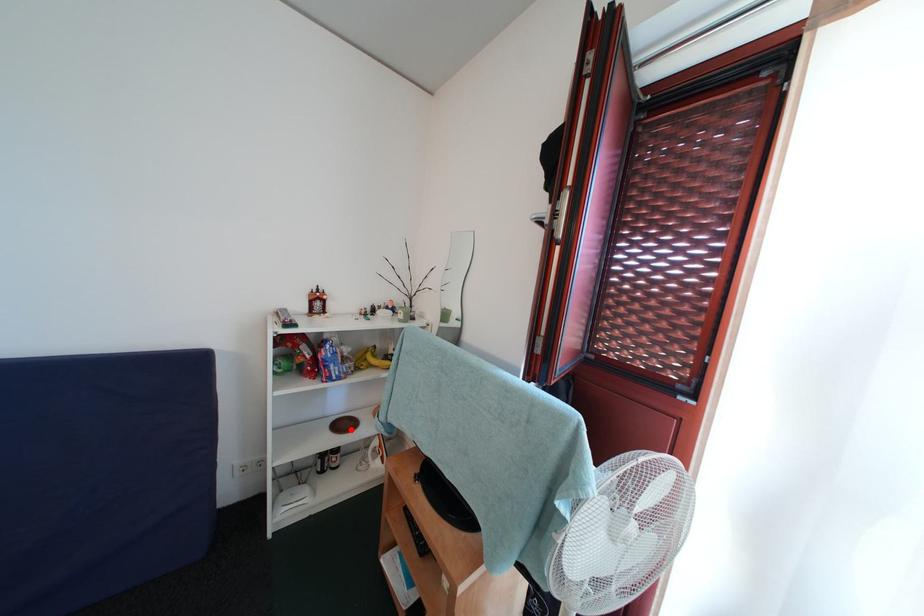
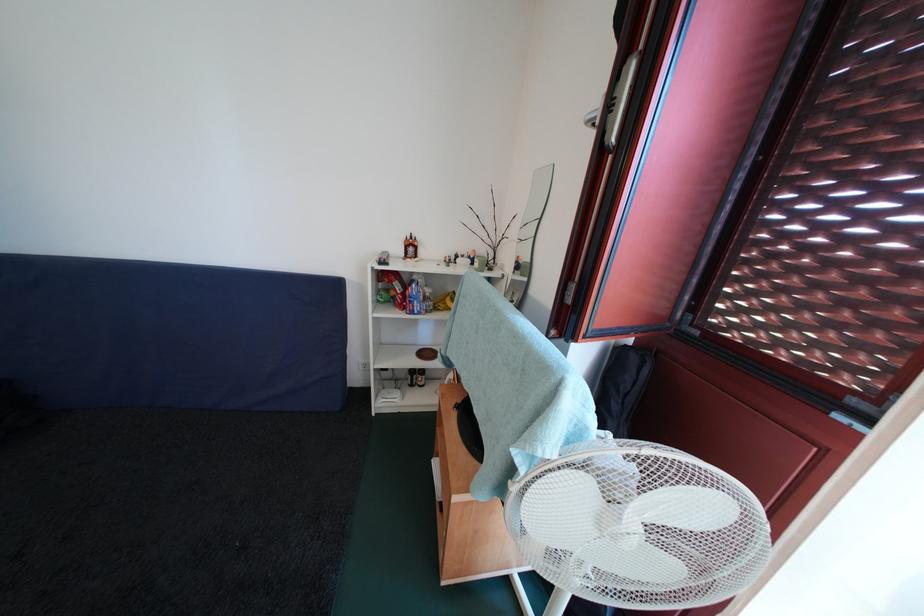
Locate, in the second image, the point that corresponds to the highlighted location in the first image.

(433, 359)